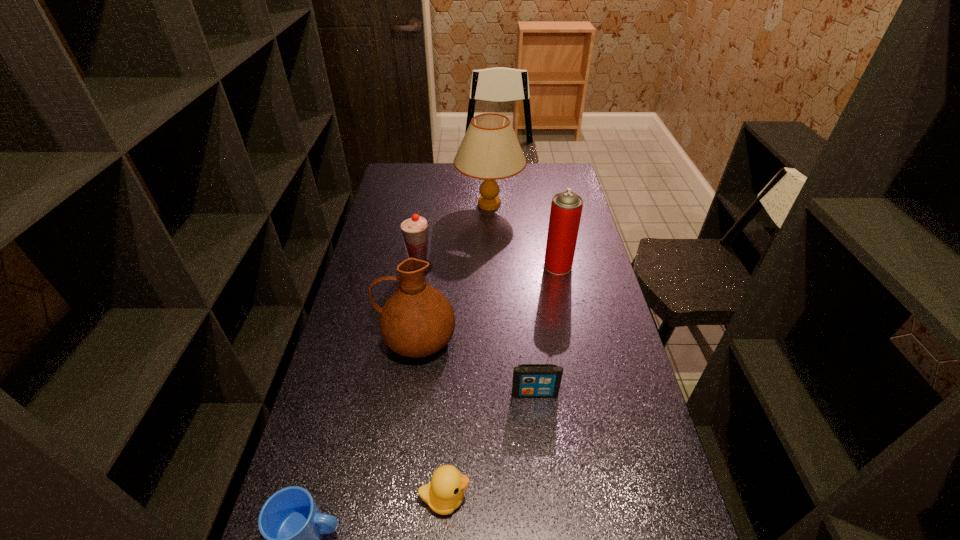
Where is `vacant space that's between the farthest object and the rightmost object`? This screenshot has height=540, width=960. vacant space that's between the farthest object and the rightmost object is located at coordinates (523, 235).

Find the location of a particular element. The image size is (960, 540). free space between the fourth farthest object and the duck is located at coordinates [x=431, y=418].

Locate an element on the screen. vacant area that lies between the farthest object and the fourth nearest object is located at coordinates (453, 272).

Locate an element on the screen. This screenshot has height=540, width=960. free spot between the duck and the smoothie is located at coordinates 432,383.

Locate an element on the screen. free space between the lampshade and the rightmost object is located at coordinates (523, 235).

This screenshot has width=960, height=540. I want to click on vacant area between the duck and the smoothie, so click(432, 383).

Locate an element on the screen. This screenshot has height=540, width=960. object that stands as the sixth closest to the mug is located at coordinates (490, 151).

I want to click on object that stands as the fifth closest to the farthest object, so tap(445, 493).

Find the location of a particular element. This screenshot has width=960, height=540. vacant region that satisfies the following two spatial constraints: 1. on the front screen of the fifth farthest object; 2. on the face of the duck is located at coordinates (546, 498).